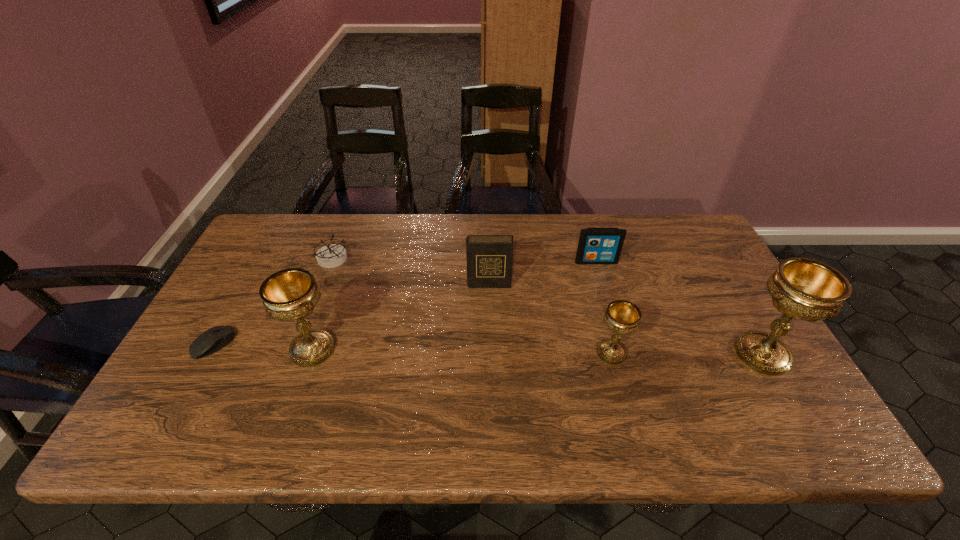
Where is `free spot between the third shortest object and the rightmost chalice`? This screenshot has height=540, width=960. free spot between the third shortest object and the rightmost chalice is located at coordinates (680, 308).

Find the location of a particular element. The width and height of the screenshot is (960, 540). vacant space in between the third shortest object and the leftmost object is located at coordinates (404, 303).

The height and width of the screenshot is (540, 960). I want to click on free space between the shortest chalice and the second shortest object, so pos(471,306).

Find the location of a particular element. vacant region between the compass and the diary is located at coordinates (411, 272).

The height and width of the screenshot is (540, 960). I want to click on vacant region between the shortest chalice and the second shortest object, so click(x=471, y=306).

Image resolution: width=960 pixels, height=540 pixels. Find the location of `free space that is in between the fourth object from right to left and the second shortest object`. free space that is in between the fourth object from right to left and the second shortest object is located at coordinates (411, 272).

You are a GUI agent. You are given a task and a screenshot of the screen. Output one action in this format:
    pyautogui.click(x=<x>, y=<y>)
    Task: Click on the second closest object to the second tallest chalice
    The image size is (960, 540).
    Given the screenshot: What is the action you would take?
    (x=330, y=256)

Choose which object is the fourth nearest neighbor to the compass. Please provide its 2D coordinates. Your answer should be formatted as a tuple, i.e. [(x, y)], where the tuple contains the x and y coordinates of a point satisfying the conditions above.

[(596, 245)]

Image resolution: width=960 pixels, height=540 pixels. I want to click on chalice identified as the closest to the computer equipment, so click(x=291, y=294).

Identify which chalice is the nearest to the shortest chalice. Please provide its 2D coordinates. Your answer should be formatted as a tuple, i.e. [(x, y)], where the tuple contains the x and y coordinates of a point satisfying the conditions above.

[(806, 289)]